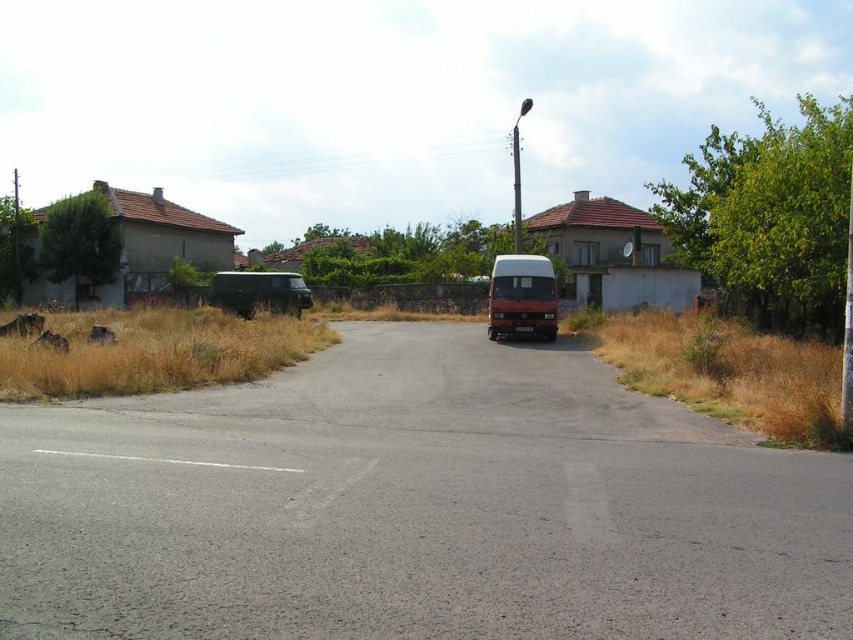
Question: Can you confirm if matte red van at center is thinner than dark green matte van at left?

Choices:
 (A) yes
 (B) no

Answer: (A)

Question: Which of the following is the closest to the observer?

Choices:
 (A) black matte van at center
 (B) matte red van at center

Answer: (A)

Question: Which point is closer to the camera?

Choices:
 (A) (525, 308)
 (B) (167, 509)

Answer: (B)

Question: Can you confirm if black matte van at center is positioned to the right of dark green matte van at left?

Choices:
 (A) yes
 (B) no

Answer: (A)

Question: Does black matte van at center have a greater width compared to dark green matte van at left?

Choices:
 (A) yes
 (B) no

Answer: (A)

Question: Which of these objects is positioned closest to the matte red van at center?

Choices:
 (A) black matte van at center
 (B) dark green matte van at left

Answer: (B)